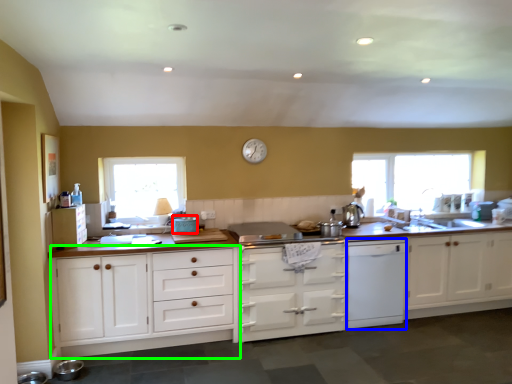
Question: Based on their relative distances, which object is farther from appliance (highlighted by a red box)? Choose from dish washer (highlighted by a blue box) and cabinetry (highlighted by a green box).

Choices:
 (A) dish washer
 (B) cabinetry

Answer: (A)